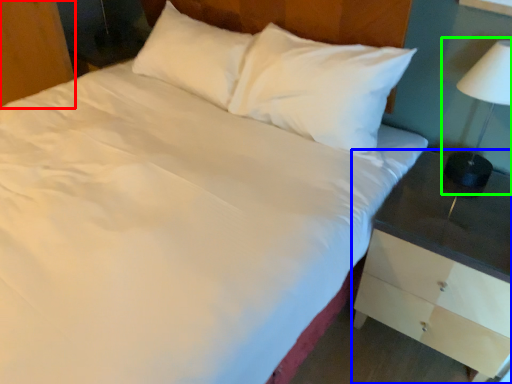
Question: Considering the real-world distances, which object is closest to dresser (highlighted by a red box)? nightstand (highlighted by a blue box) or bedside lamp (highlighted by a green box).

Choices:
 (A) nightstand
 (B) bedside lamp

Answer: (A)